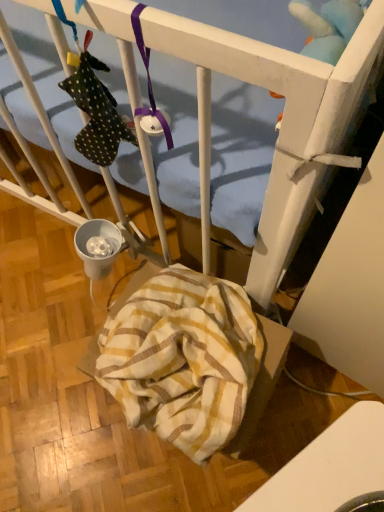
At what (x,y) coordinates should I click in order to perform the action: click on free point to the left of white glossy table at lower right. Please return your answer as a coordinate pair (x, y). Looking at the image, I should click on (181, 478).